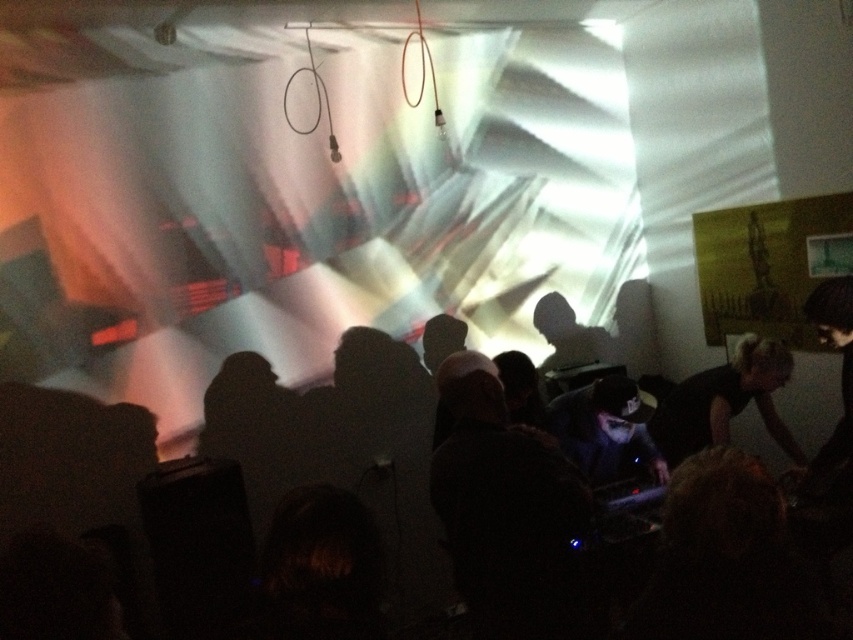
Between dark hair at center and black matte shirt at right, which one is positioned higher?

black matte shirt at right

Can you confirm if dark hair at center is positioned to the left of black matte shirt at right?

Yes, dark hair at center is to the left of black matte shirt at right.

What do you see at coordinates (347, 442) in the screenshot? I see `dark hair at center` at bounding box center [347, 442].

This screenshot has width=853, height=640. I want to click on dark hair at center, so click(347, 442).